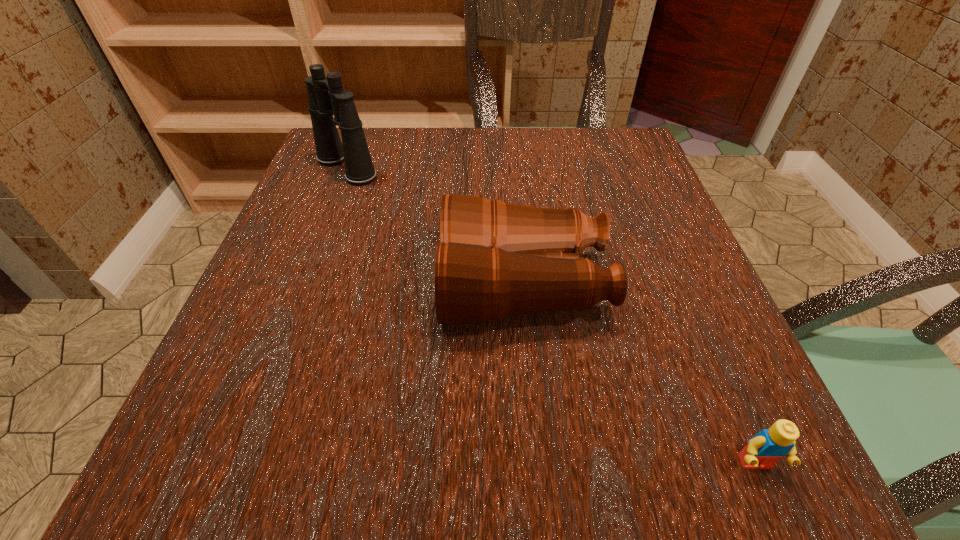
Image resolution: width=960 pixels, height=540 pixels. Find the location of `the farthest object`. the farthest object is located at coordinates (326, 96).

You are a GUI agent. You are given a task and a screenshot of the screen. Output one action in this format:
    pyautogui.click(x=<x>, y=<y>)
    Task: Click on the left binoculars
    This screenshot has height=540, width=960.
    Given the screenshot: What is the action you would take?
    click(326, 96)

This screenshot has width=960, height=540. I want to click on the nearer binoculars, so 495,260.

Where is `the second shortest object`? the second shortest object is located at coordinates (495, 260).

Identify the location of the rightmost object. (763, 450).

Locate an element on the screen. This screenshot has height=540, width=960. Lego is located at coordinates (763, 450).

The image size is (960, 540). Find the location of `vacant space located on the front of the farthest object`. vacant space located on the front of the farthest object is located at coordinates (300, 288).

Find the location of a particular element. The image size is (960, 540). vacant area situated 0.250m through the lenses of the shorter binoculars is located at coordinates (293, 285).

Find the location of a particular element. free location located 0.070m through the lenses of the shorter binoculars is located at coordinates (401, 285).

This screenshot has width=960, height=540. Find the location of `free point located 0.100m through the lenses of the shorter binoculars`. free point located 0.100m through the lenses of the shorter binoculars is located at coordinates (383, 285).